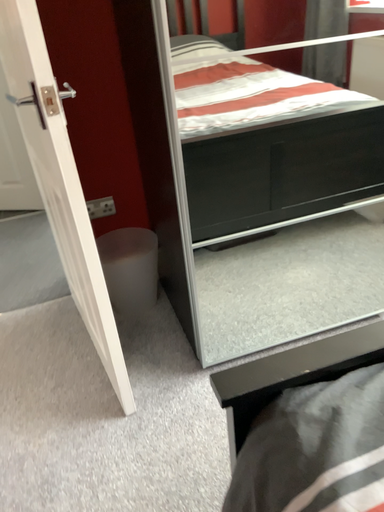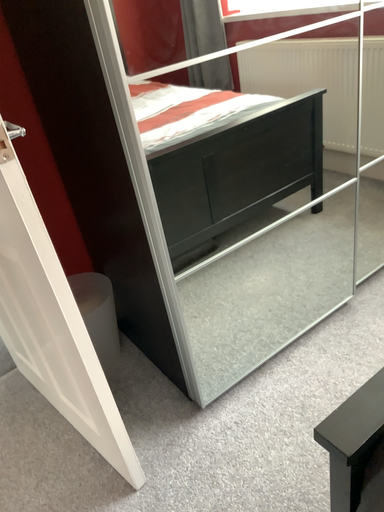
Question: Which way did the camera rotate in the video?

Choices:
 (A) rotated right
 (B) rotated left

Answer: (A)